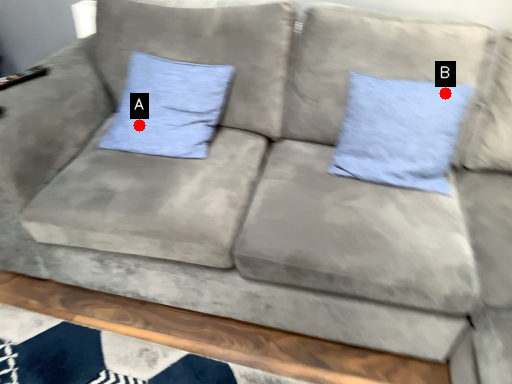
Question: Two points are circled on the image, labeled by A and B beside each circle. Which point is further to the camera?

Choices:
 (A) A is further
 (B) B is further

Answer: (A)